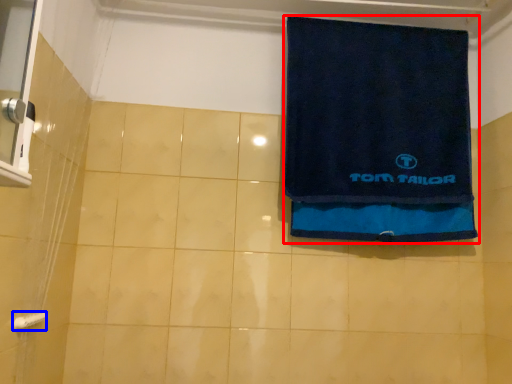
Question: Which point is closer to the camera, towel (highlighted by a red box) or towel bar (highlighted by a blue box)?

Choices:
 (A) towel
 (B) towel bar

Answer: (B)